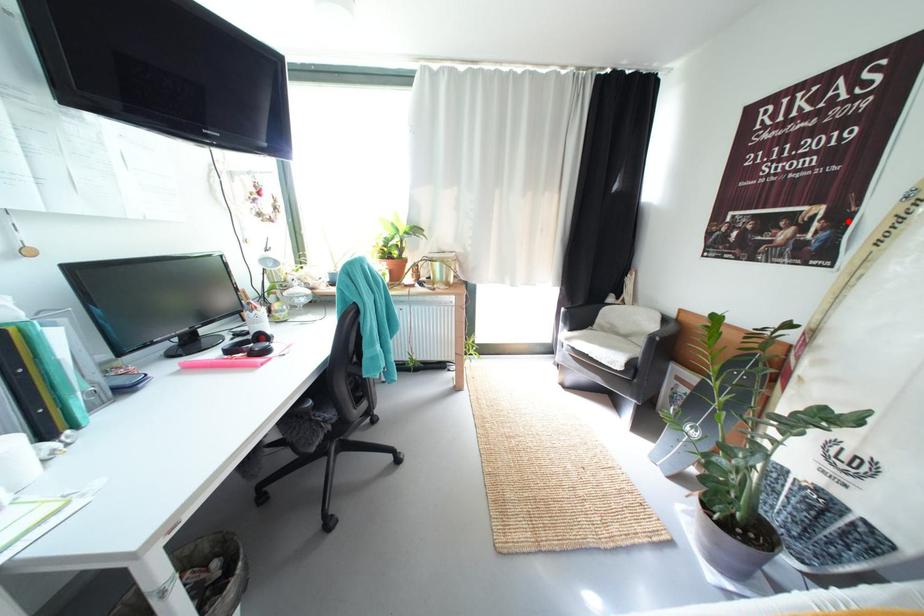
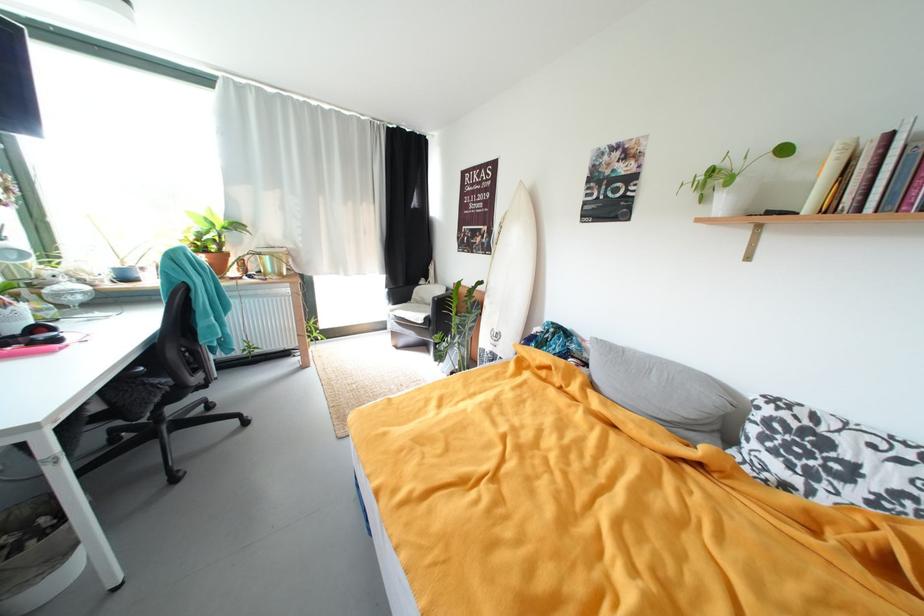
Question: I am providing you with two images of the same scene from different viewpoints. Given a red point in image1, look at the same physical point in image2. Is it:

Choices:
 (A) Closer to the viewpoint
 (B) Farther from the viewpoint

Answer: (A)